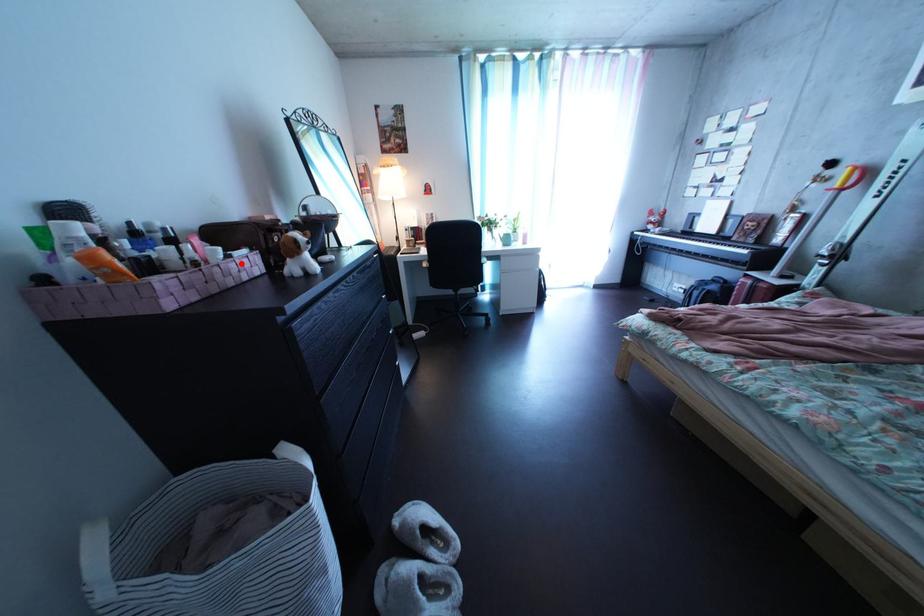
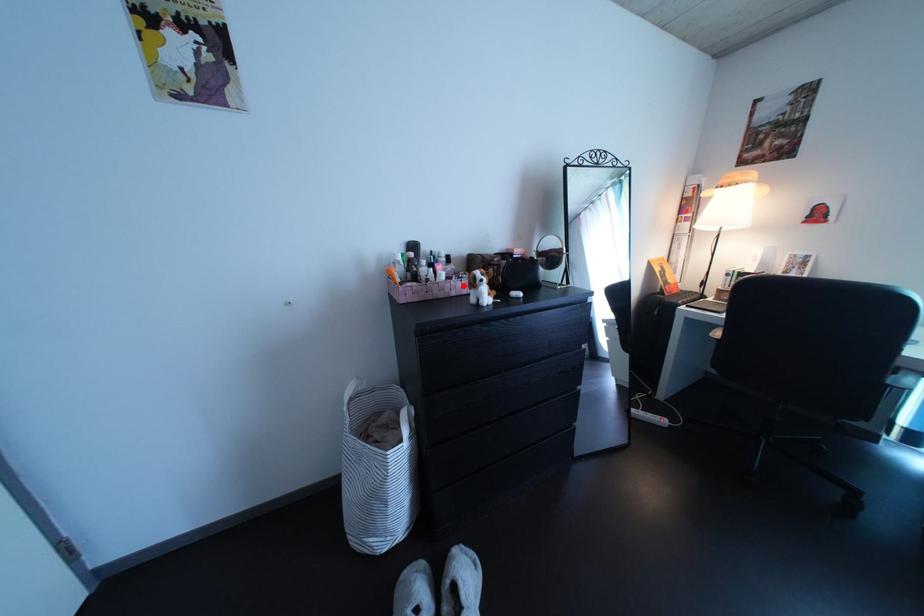
I am providing you with two images of the same scene from different viewpoints. A red point is marked on the first image and another point is marked on the second image. Are the points marked in image1 and image2 representing the same 3D position?

Yes